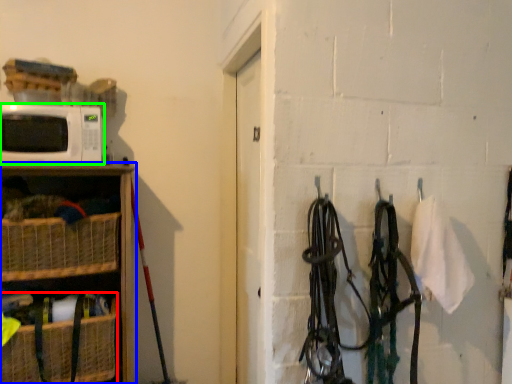
Question: Which object is the farthest from basket (highlighted by a red box)? Choose among these: shelf (highlighted by a blue box) or microwave oven (highlighted by a green box).

Choices:
 (A) shelf
 (B) microwave oven

Answer: (B)